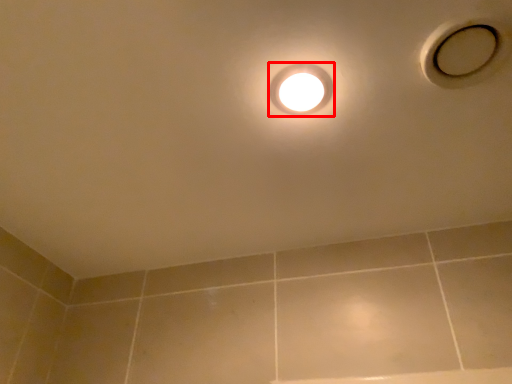
Question: From the image's perspective, where is droplight (annotated by the red box) located in relation to hole in the image?

Choices:
 (A) below
 (B) above

Answer: (A)